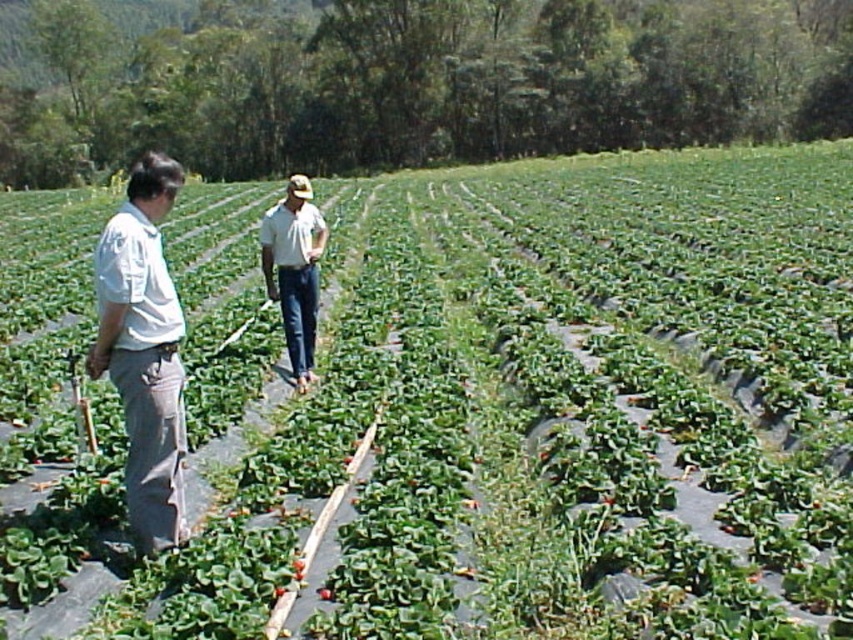
You are a farmer walking through the strawberry field. You see the white cotton shirt at left and the denim jeans at center. Which one is lower in position?

The white cotton shirt at left is below denim jeans at center, so the white cotton shirt at left is lower in position.

You are standing in the strawberry field and want to approach both the white cotton shirt at left and the denim jeans at center. Which one should you head towards first to reach the closer one first?

You should head towards the white cotton shirt at left first because it is closer to the viewer than the denim jeans at center.